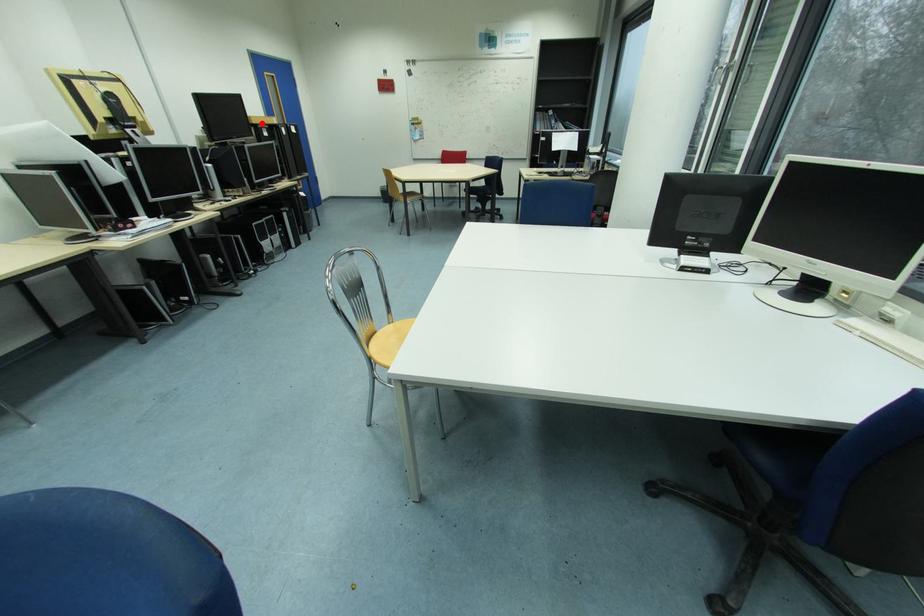
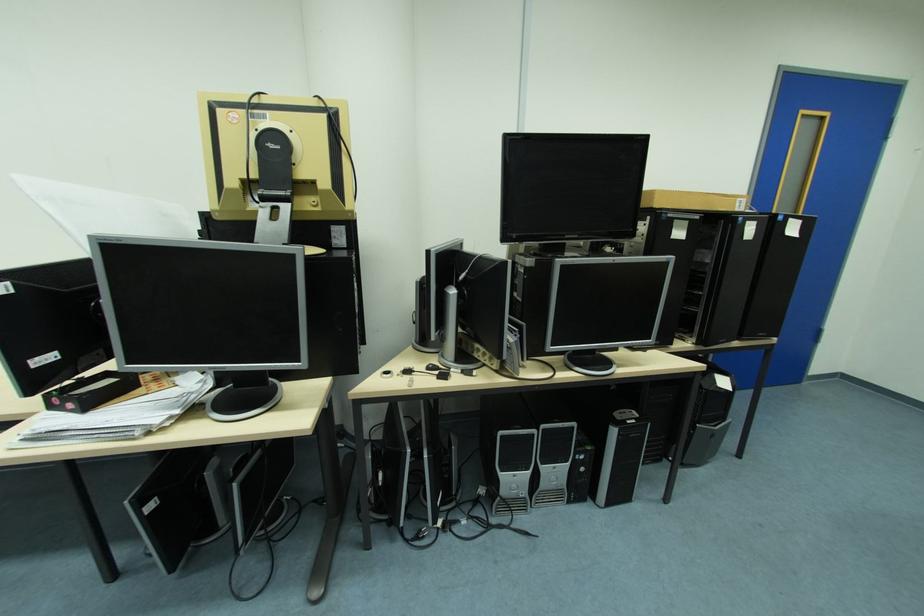
Where in the second image is the point corresponding to the highlighted location from the first image?

(664, 206)